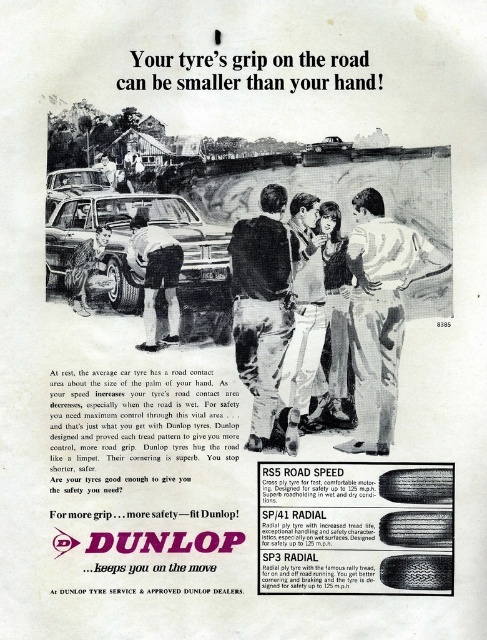
Who is lower down, denim jeans at center or black rubber tire at center?

Positioned lower is denim jeans at center.

Is point (318, 230) farther from camera compared to point (127, 294)?

No, (318, 230) is closer to viewer.

Who is more forward, (348, 422) or (118, 276)?

Point (348, 422)

Locate an element on the screen. denim jeans at center is located at coordinates (335, 320).

Can you confirm if white striped shirt at center is positioned below dark blue jeans at center?

Yes, white striped shirt at center is below dark blue jeans at center.

Which is above, white striped shirt at center or dark blue jeans at center?

Positioned higher is dark blue jeans at center.

Where is `white striped shirt at center`? This screenshot has height=640, width=487. white striped shirt at center is located at coordinates (379, 314).

Between white cotton shirt at center and black rubber tire at center, which one appears on the left side from the viewer's perspective?

black rubber tire at center is more to the left.

Describe the element at coordinates (303, 323) in the screenshot. I see `white cotton shirt at center` at that location.

In the scene shown: Who is more distant from viewer, (x=308, y=218) or (x=127, y=310)?

Point (x=308, y=218)

Where is `white cotton shirt at center`? The height and width of the screenshot is (640, 487). white cotton shirt at center is located at coordinates (303, 323).